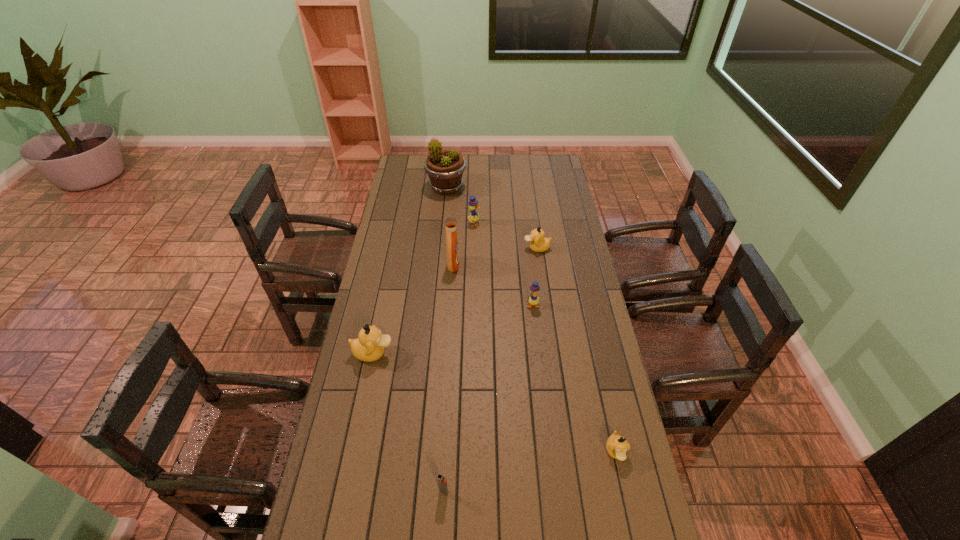
The width and height of the screenshot is (960, 540). I want to click on duckling identified as the second closest to the farthest tan duckling, so click(x=533, y=300).

Identify which duckling is located as the third nearest to the nearest duckling. Please provide its 2D coordinates. Your answer should be formatted as a tuple, i.e. [(x, y)], where the tuple contains the x and y coordinates of a point satisfying the conditions above.

[(538, 243)]

You are a GUI agent. You are given a task and a screenshot of the screen. Output one action in this format:
    pyautogui.click(x=<x>, y=<y>)
    Task: Click on the closest tan duckling to the igniter
    
    Given the screenshot: What is the action you would take?
    pyautogui.click(x=369, y=346)

At what (x,y) coordinates should I click in order to perform the action: click on the closest tan duckling to the fifth farthest object. Please return your answer as a coordinate pair (x, y). Looking at the image, I should click on (538, 243).

Identify which yellow duckling is located as the second nearest to the leftmost tan duckling. Please provide its 2D coordinates. Your answer should be formatted as a tuple, i.e. [(x, y)], where the tuple contains the x and y coordinates of a point satisfying the conditions above.

[(473, 204)]

Find the location of `yellow duckling identified as the closest to the rightmost tan duckling`. yellow duckling identified as the closest to the rightmost tan duckling is located at coordinates (533, 300).

You are a GUI agent. You are given a task and a screenshot of the screen. Output one action in this format:
    pyautogui.click(x=<x>, y=<y>)
    Task: Click on the vacant region that satisfies the following two spatial constraints: 1. on the face of the sixth farthest object; 2. on the right side of the nearest object
    This screenshot has height=540, width=960.
    Given the screenshot: What is the action you would take?
    pyautogui.click(x=345, y=491)

At what (x,y) coordinates should I click in order to perform the action: click on vacant region that satisfies the following two spatial constraints: 1. on the face of the sixth nearest object; 2. on the face of the right yellow duckling, where the monocle is placed. Please return your answer as a coordinate pair (x, y). The height and width of the screenshot is (540, 960). Looking at the image, I should click on (544, 305).